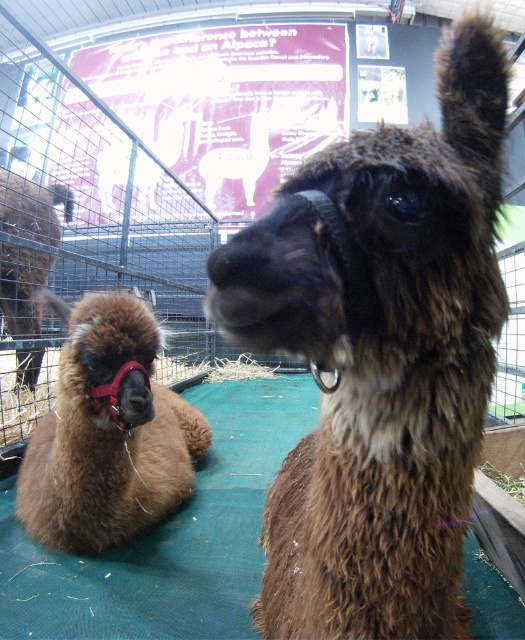
You are a zookeeper who needs to ensure all alpacas have enough space in their enclosure. The enclosure has a narrow path that is only wide enough for one alpaca at a time. If both brown fuzzy alpaca at center and brown fuzzy alpaca at left want to walk through the path simultaneously, which alpaca would you suggest moves first to avoid a blockage?

The brown fuzzy alpaca at center is thinner than the brown fuzzy alpaca at left, so it can pass through the narrow path more easily. Therefore, you should suggest the brown fuzzy alpaca at left to move first, allowing the thinner alpaca to follow without causing a blockage.

You are standing at the entrance of the enclosure and want to approach both alpacas. The first alpaca is at point (78, 429) and the second is at point (36, 276). Which alpaca should you approach first if you want to reach the one closer to the entrance?

The alpaca at point (78, 429) is closer to the entrance because it is in front of point (36, 276). Therefore, you should approach the alpaca at point (78, 429) first.

You are standing in front of the enclosure and want to take a photo of both points mentioned. Which point, point (379, 618) or point (25, 180), will appear larger in your photo?

Point (379, 618) will appear larger in the photo because it is closer to the camera than point (25, 180).